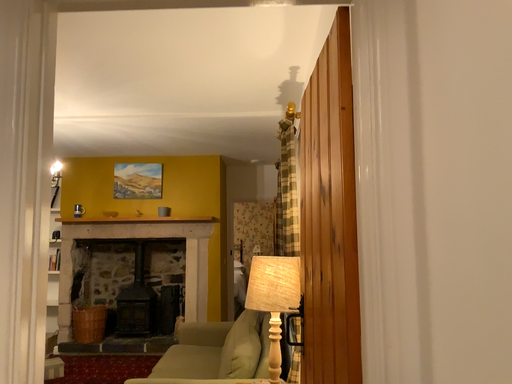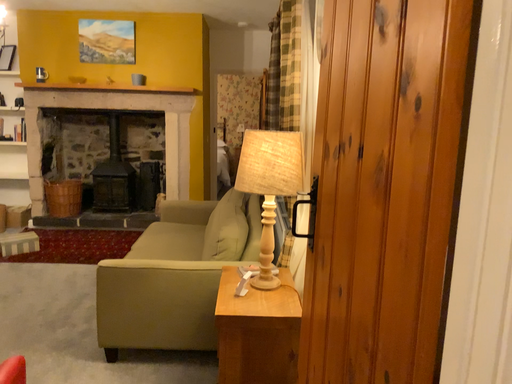
Question: Which way did the camera rotate in the video?

Choices:
 (A) rotated downward
 (B) rotated upward

Answer: (A)